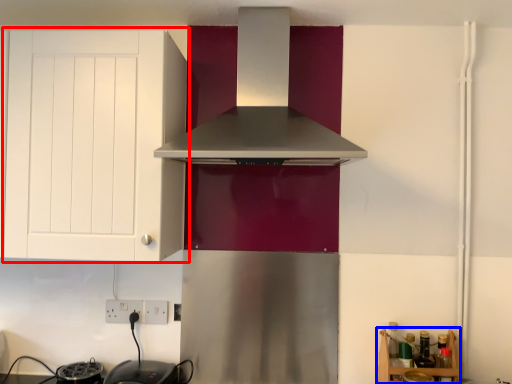
Question: Which point is further to the camera, cabinetry (highlighted by a red box) or shelf (highlighted by a blue box)?

Choices:
 (A) cabinetry
 (B) shelf

Answer: (B)